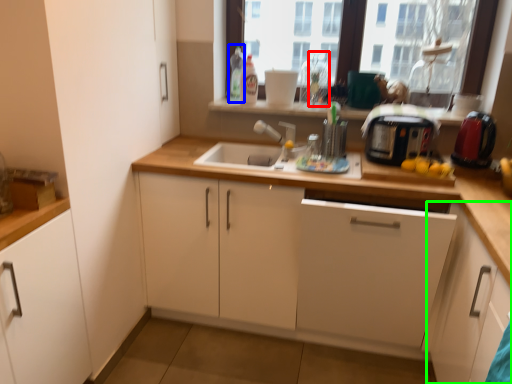
Question: Which object is positioned closest to bottle (highlighted by a red box)? Select from bottle (highlighted by a blue box) and cabinetry (highlighted by a green box).

Choices:
 (A) bottle
 (B) cabinetry

Answer: (A)